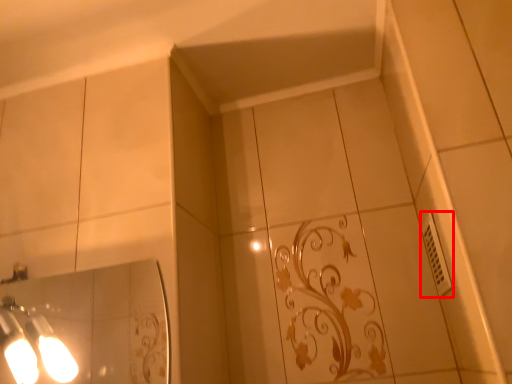
Question: From the image's perspective, what is the correct spatial relationship of electric outlet (annotated by the red box) in relation to light fixture?

Choices:
 (A) above
 (B) below

Answer: (A)